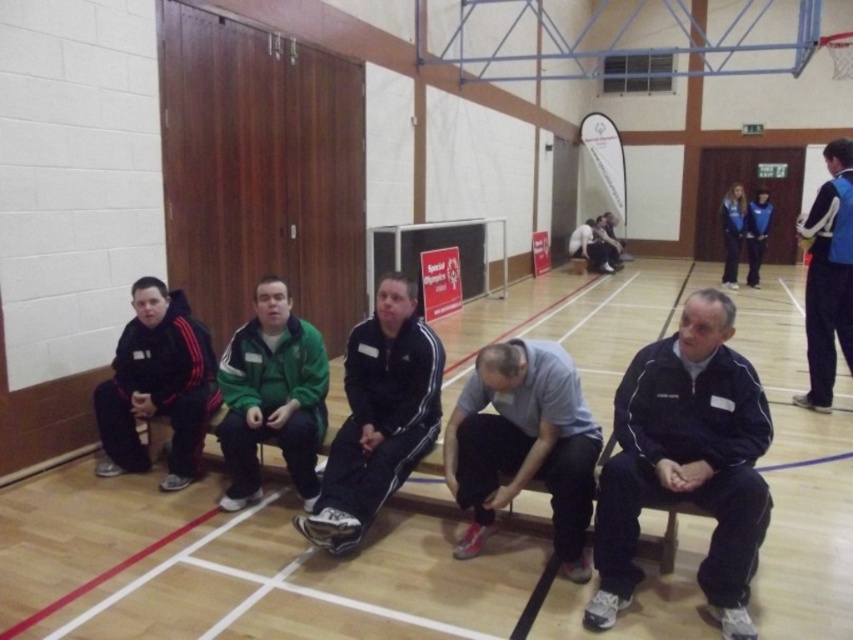
Question: Among these points, which one is farthest from the camera?

Choices:
 (A) (589, 492)
 (B) (691, 508)
 (C) (712, 444)

Answer: (A)

Question: Does black fleece jacket at left have a lesser width compared to blue fabric jacket at right?

Choices:
 (A) yes
 (B) no

Answer: (B)

Question: Is black fleece jacket at left wider than black fabric bench at center?

Choices:
 (A) yes
 (B) no

Answer: (A)

Question: Can you confirm if black matte jacket at center is positioned to the right of blue fabric jacket at right?

Choices:
 (A) no
 (B) yes

Answer: (A)

Question: Which of the following is the farthest from the observer?

Choices:
 (A) (657, 541)
 (B) (190, 387)
 (C) (445, 472)

Answer: (B)

Question: Among these objects, which one is farthest from the camera?

Choices:
 (A) black fabric bench at center
 (B) gray fabric shirt at center
 (C) blue fabric jacket at right
 (D) black fleece jacket at left

Answer: (C)